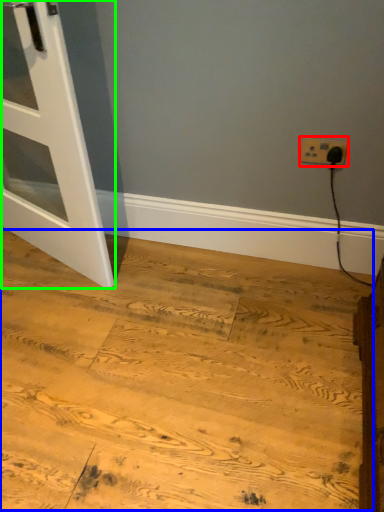
Question: Which is farther away from power plugs and sockets (highlighted by a red box)? plywood (highlighted by a blue box) or door (highlighted by a green box)?

Choices:
 (A) plywood
 (B) door

Answer: (B)